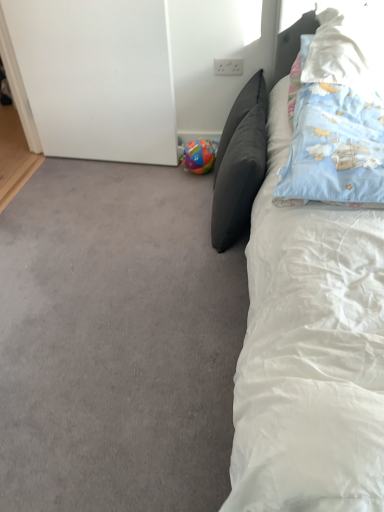
Identify the location of free space to the left of multicolored plastic ball at lower left. The image size is (384, 512). (155, 170).